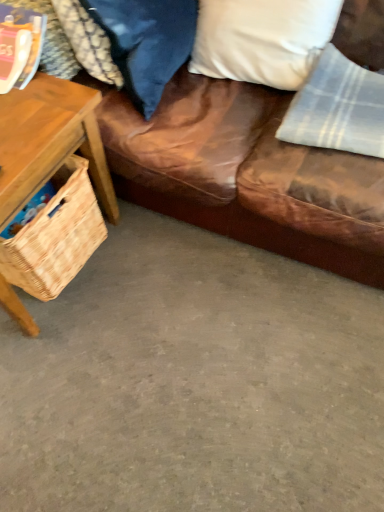
What do you see at coordinates (49, 141) in the screenshot? Image resolution: width=384 pixels, height=512 pixels. I see `woven wood basket at left` at bounding box center [49, 141].

Describe the element at coordinates (337, 106) in the screenshot. Image resolution: width=384 pixels, height=512 pixels. I see `light gray plaid fabric at upper right` at that location.

The height and width of the screenshot is (512, 384). I want to click on velvet blue pillow at upper center, placed as the 1th pillow when sorted from left to right, so click(x=147, y=42).

From the picture: Considering the sizes of woven wood basket at left and velvet blue pillow at upper center, which is counted as the second pillow, starting from the right, in the image, is woven wood basket at left bigger or smaller than velvet blue pillow at upper center, which is counted as the second pillow, starting from the right,?

In the image, woven wood basket at left appears to be larger than velvet blue pillow at upper center, which is counted as the second pillow, starting from the right.

Considering the relative sizes of woven wood basket at left and velvet blue pillow at upper center, placed as the 1th pillow when sorted from left to right, in the image provided, is woven wood basket at left thinner than velvet blue pillow at upper center, placed as the 1th pillow when sorted from left to right,?

No.

From the image's perspective, is woven wood basket at left on velvet blue pillow at upper center, placed as the 1th pillow when sorted from left to right?

No, from the image's perspective, woven wood basket at left is not above velvet blue pillow at upper center, placed as the 1th pillow when sorted from left to right.

Between light gray plaid fabric at upper right and white soft pillow at upper right, which ranks as the first pillow in right-to-left order, which one has smaller size?

With smaller size is light gray plaid fabric at upper right.

Could you tell me if light gray plaid fabric at upper right is facing white soft pillow at upper right, which ranks as the first pillow in right-to-left order?

No, light gray plaid fabric at upper right is not oriented towards white soft pillow at upper right, which ranks as the first pillow in right-to-left order.

Considering the relative positions of light gray plaid fabric at upper right and white soft pillow at upper right, which ranks as the first pillow in right-to-left order, in the image provided, is light gray plaid fabric at upper right to the right of white soft pillow at upper right, which ranks as the first pillow in right-to-left order, from the viewer's perspective?

Indeed, light gray plaid fabric at upper right is positioned on the right side of white soft pillow at upper right, which ranks as the first pillow in right-to-left order.

From a real-world perspective, is velvet blue pillow at upper center, placed as the 1th pillow when sorted from left to right, positioned above or below woven wood basket at left?

velvet blue pillow at upper center, placed as the 1th pillow when sorted from left to right, is situated higher than woven wood basket at left in the real world.

Between velvet blue pillow at upper center, placed as the 1th pillow when sorted from left to right, and woven wood basket at left, which one has less height?

velvet blue pillow at upper center, placed as the 1th pillow when sorted from left to right.

Measure the distance from velvet blue pillow at upper center, placed as the 1th pillow when sorted from left to right, to woven wood basket at left.

They are 10.05 inches apart.

Based on the photo, between velvet blue pillow at upper center, placed as the 1th pillow when sorted from left to right, and brown leather couch at upper right, which one is positioned in front?

brown leather couch at upper right is more forward.

From the image's perspective, relative to brown leather couch at upper right, is velvet blue pillow at upper center, placed as the 1th pillow when sorted from left to right, above or below?

From the image's perspective, velvet blue pillow at upper center, placed as the 1th pillow when sorted from left to right, appears above brown leather couch at upper right.

From a real-world perspective, is velvet blue pillow at upper center, placed as the 1th pillow when sorted from left to right, under brown leather couch at upper right?

No.

Between velvet blue pillow at upper center, which is counted as the second pillow, starting from the right, and brown leather couch at upper right, which one has less height?

velvet blue pillow at upper center, which is counted as the second pillow, starting from the right.

From the image's perspective, between woven straw picnic basket at left and woven wood basket at left, who is located below?

woven straw picnic basket at left appears lower in the image.

Who is taller, woven straw picnic basket at left or woven wood basket at left?

Standing taller between the two is woven wood basket at left.

Locate an element on the screen. The width and height of the screenshot is (384, 512). round table above the woven straw picnic basket at left (from a real-world perspective) is located at coordinates (49, 141).

Can you confirm if white soft pillow at upper right, which is the 2th pillow in left-to-right order, is shorter than gray concrete floor at lower center?

In fact, white soft pillow at upper right, which is the 2th pillow in left-to-right order, may be taller than gray concrete floor at lower center.

From the image's perspective, which is below, white soft pillow at upper right, which ranks as the first pillow in right-to-left order, or gray concrete floor at lower center?

gray concrete floor at lower center.

Is gray concrete floor at lower center completely or partially inside white soft pillow at upper right, which is the 2th pillow in left-to-right order?

Actually, gray concrete floor at lower center is outside white soft pillow at upper right, which is the 2th pillow in left-to-right order.

Does white soft pillow at upper right, which is the 2th pillow in left-to-right order, have a lesser width compared to gray concrete floor at lower center?

Correct, the width of white soft pillow at upper right, which is the 2th pillow in left-to-right order, is less than that of gray concrete floor at lower center.

Which point is more forward, (382, 106) or (17, 208)?

The point (17, 208) is closer to the camera.

Is light gray plaid fabric at upper right facing towards woven wood basket at left?

No, light gray plaid fabric at upper right does not turn towards woven wood basket at left.

Is light gray plaid fabric at upper right outside of woven wood basket at left?

Yes, light gray plaid fabric at upper right is not within woven wood basket at left.

Locate an element on the screen. the 1st pillow behind the woven wood basket at left, starting your count from the anchor is located at coordinates (147, 42).

From the image's perspective, which pillow is the 2nd one above the light gray plaid fabric at upper right? Please provide its 2D coordinates.

[(262, 39)]

Estimate the real-world distances between objects in this image. Which object is closer to woven wood basket at left, light gray plaid fabric at upper right or brown leather couch at upper right?

The object closer to woven wood basket at left is brown leather couch at upper right.

Estimate the real-world distances between objects in this image. Which object is further from woven wood basket at left, white soft pillow at upper right, which ranks as the first pillow in right-to-left order, or light gray plaid fabric at upper right?

Based on the image, light gray plaid fabric at upper right appears to be further to woven wood basket at left.

Considering their positions, is woven straw picnic basket at left positioned further to velvet blue pillow at upper center, placed as the 1th pillow when sorted from left to right, than brown leather couch at upper right?

Based on the image, woven straw picnic basket at left appears to be further to velvet blue pillow at upper center, placed as the 1th pillow when sorted from left to right.

Looking at the image, which one is located further to brown leather couch at upper right, light gray plaid fabric at upper right or woven straw picnic basket at left?

woven straw picnic basket at left.

Estimate the real-world distances between objects in this image. Which object is closer to woven wood basket at left, gray concrete floor at lower center or brown leather couch at upper right?

The object closer to woven wood basket at left is brown leather couch at upper right.

Considering their positions, is gray concrete floor at lower center positioned further to white soft pillow at upper right, which ranks as the first pillow in right-to-left order, than woven straw picnic basket at left?

Based on the image, gray concrete floor at lower center appears to be further to white soft pillow at upper right, which ranks as the first pillow in right-to-left order.

Based on their spatial positions, is woven wood basket at left or velvet blue pillow at upper center, placed as the 1th pillow when sorted from left to right, further from woven straw picnic basket at left?

Based on the image, velvet blue pillow at upper center, placed as the 1th pillow when sorted from left to right, appears to be further to woven straw picnic basket at left.

From the picture: Considering their positions, is velvet blue pillow at upper center, placed as the 1th pillow when sorted from left to right, positioned further to light gray plaid fabric at upper right than woven wood basket at left?

woven wood basket at left is further to light gray plaid fabric at upper right.

Find the location of `studio couch between white soft pillow at upper right, which is the 2th pillow in left-to-right order, and gray concrete floor at lower center vertically`. studio couch between white soft pillow at upper right, which is the 2th pillow in left-to-right order, and gray concrete floor at lower center vertically is located at coordinates (245, 173).

Where is `material between velvet blue pillow at upper center, placed as the 1th pillow when sorted from left to right, and gray concrete floor at lower center in the up-down direction`? The width and height of the screenshot is (384, 512). material between velvet blue pillow at upper center, placed as the 1th pillow when sorted from left to right, and gray concrete floor at lower center in the up-down direction is located at coordinates [337, 106].

You are a GUI agent. You are given a task and a screenshot of the screen. Output one action in this format:
    pyautogui.click(x=<x>, y=<y>)
    Task: Click on the picnic basket between woven wood basket at left and white soft pillow at upper right, which is the 2th pillow in left-to-right order, in the horizontal direction
    This screenshot has height=512, width=384.
    Given the screenshot: What is the action you would take?
    pyautogui.click(x=53, y=233)

In order to click on round table between brown leather couch at upper right and gray concrete floor at lower center vertically in this screenshot , I will do `click(49, 141)`.